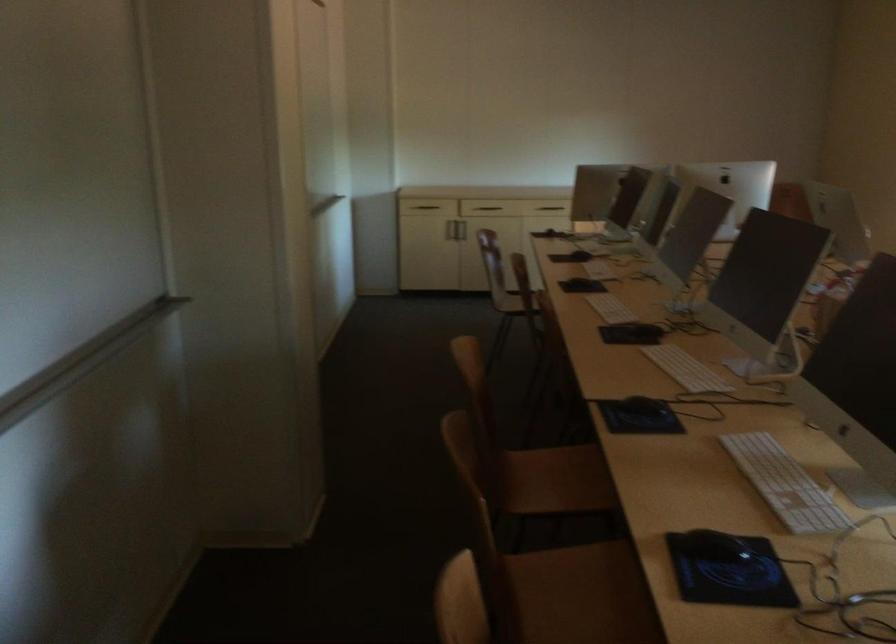
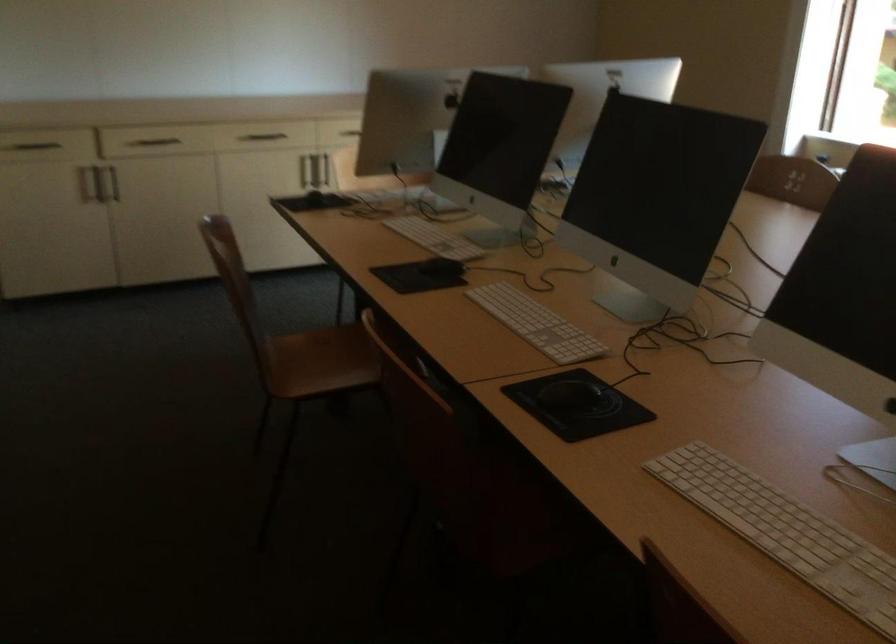
Question: What movement of the cameraman would produce the second image?

Choices:
 (A) Left
 (B) Right
 (C) Forward
 (D) Backward

Answer: (C)